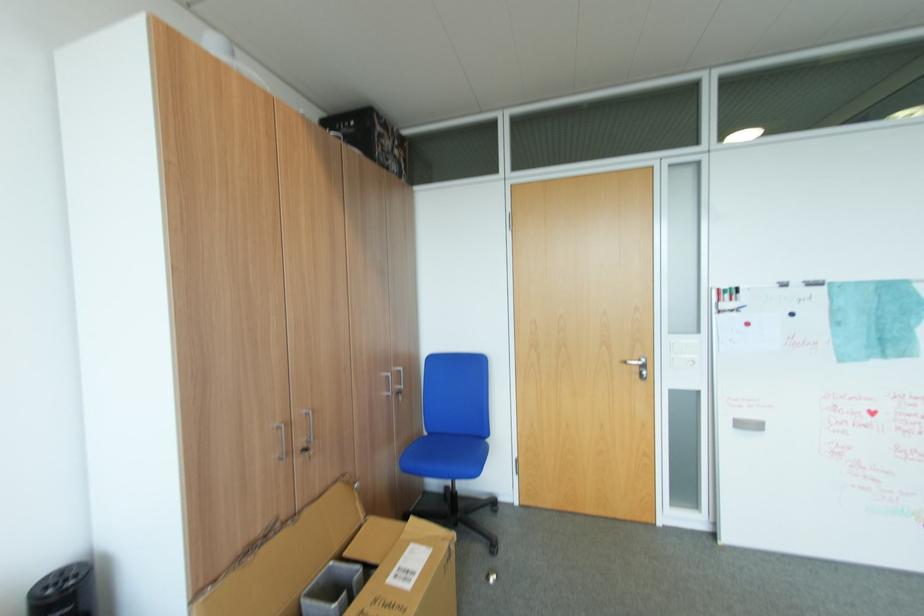
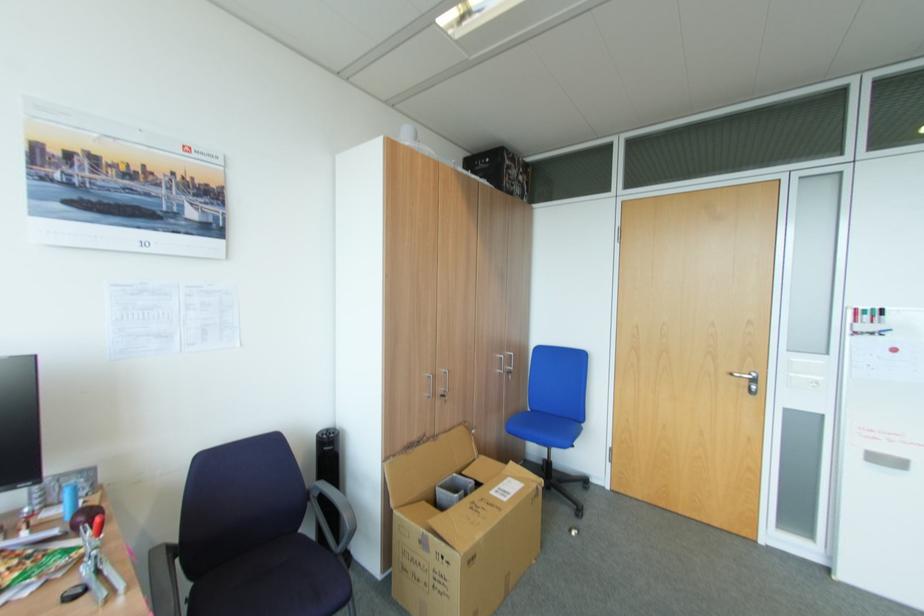
Locate, in the second image, the point that corresponds to pixel 293 454 in the first image.

(440, 394)